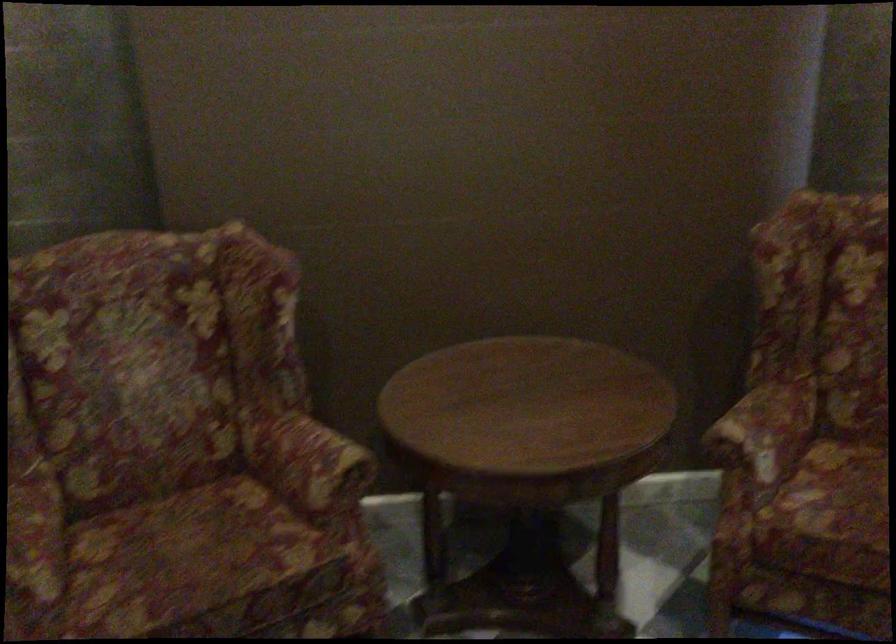
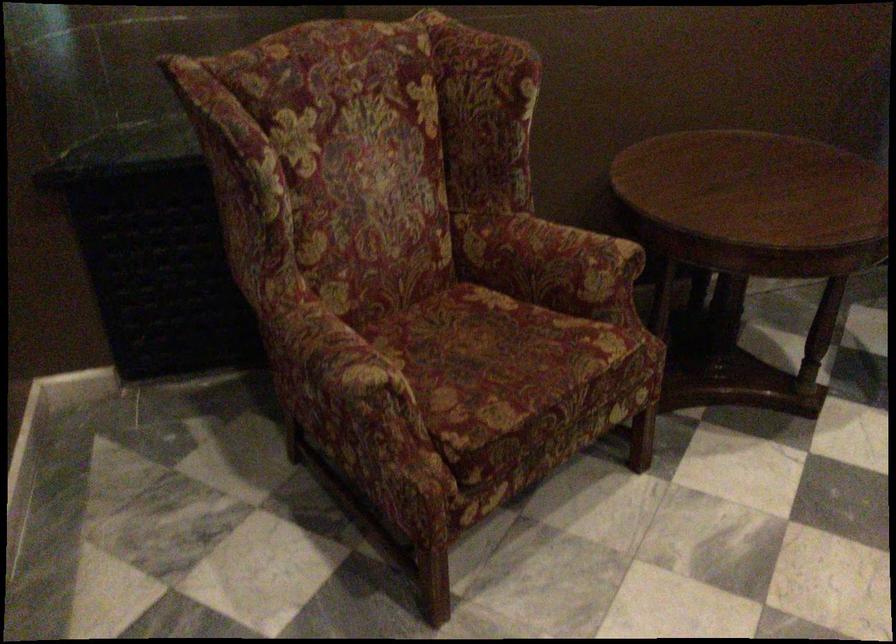
In the second image, find the point that corresponds to point (307, 460) in the first image.

(572, 256)